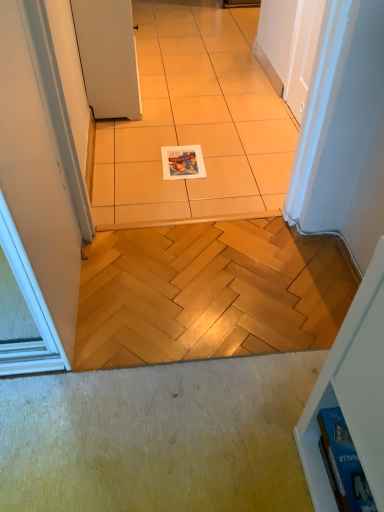
Question: Does blue glossy magazine at lower right, which ranks as the second magazine in left-to-right order, have a greater width compared to white matte door at upper left?

Choices:
 (A) yes
 (B) no

Answer: (B)

Question: Is blue glossy magazine at lower right, which is the first magazine in front-to-back order, touching white matte door at upper left?

Choices:
 (A) no
 (B) yes

Answer: (A)

Question: Considering the relative sizes of blue glossy magazine at lower right, the 1th magazine from the right, and white matte door at upper left in the image provided, is blue glossy magazine at lower right, the 1th magazine from the right, smaller than white matte door at upper left?

Choices:
 (A) yes
 (B) no

Answer: (A)

Question: Is blue glossy magazine at lower right, which ranks as the second magazine in left-to-right order, turned away from white matte door at upper left?

Choices:
 (A) yes
 (B) no

Answer: (B)

Question: From a real-world perspective, does blue glossy magazine at lower right, the second magazine viewed from the top, stand above white matte door at upper left?

Choices:
 (A) yes
 (B) no

Answer: (B)

Question: From a real-world perspective, is blue glossy magazine at lower right, the second magazine viewed from the top, physically below white matte door at upper left?

Choices:
 (A) no
 (B) yes

Answer: (B)

Question: Is matte paper magazine at center, the second magazine in the bottom-to-top sequence, wider than blue glossy magazine at lower right, which is the first magazine in front-to-back order?

Choices:
 (A) no
 (B) yes

Answer: (B)

Question: Does matte paper magazine at center, which is the 2th magazine from front to back, turn towards blue glossy magazine at lower right, the 1th magazine from the right?

Choices:
 (A) yes
 (B) no

Answer: (B)

Question: From a real-world perspective, is matte paper magazine at center, which appears as the 1th magazine when viewed from the left, on top of blue glossy magazine at lower right, positioned as the first magazine in bottom-to-top order?

Choices:
 (A) yes
 (B) no

Answer: (B)

Question: Can you confirm if matte paper magazine at center, which appears as the 1th magazine when viewed from the left, is taller than blue glossy magazine at lower right, which ranks as the second magazine in left-to-right order?

Choices:
 (A) yes
 (B) no

Answer: (A)

Question: Is blue glossy magazine at lower right, positioned as the first magazine in bottom-to-top order, a part of matte paper magazine at center, marked as the first magazine in a top-to-bottom arrangement?

Choices:
 (A) yes
 (B) no

Answer: (B)

Question: Does matte paper magazine at center, the second magazine in the bottom-to-top sequence, have a smaller size compared to blue glossy magazine at lower right, which ranks as the second magazine in left-to-right order?

Choices:
 (A) no
 (B) yes

Answer: (A)

Question: Does beige ceramic tile at center have a larger size compared to white matte door at upper left?

Choices:
 (A) yes
 (B) no

Answer: (B)